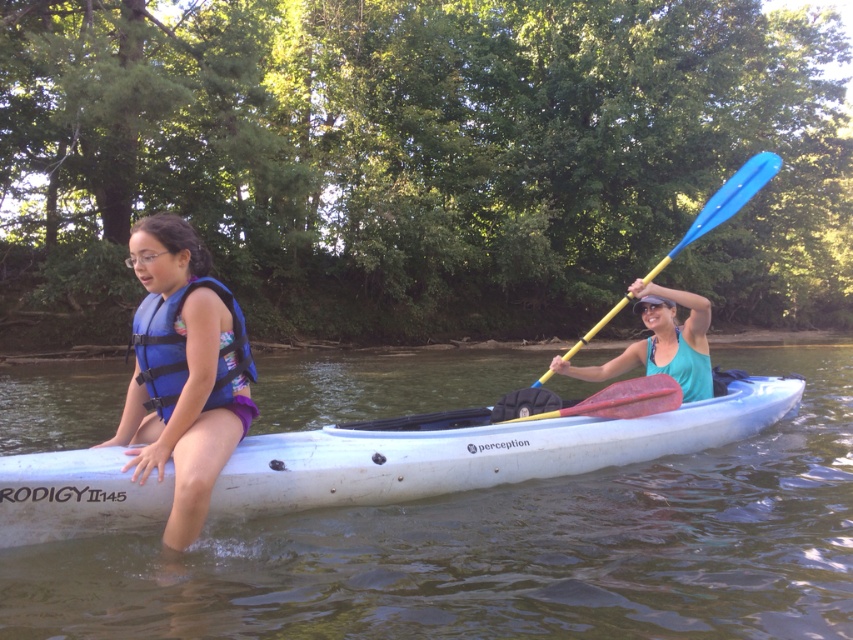
You are a kayaker who wants to store your equipment properly. You have a white plastic canoe at center and a teal fabric kayak paddle at center. Which one is shorter in height?

The white plastic canoe at center has a lesser height compared to the teal fabric kayak paddle at center, so the white plastic canoe at center is shorter in height.